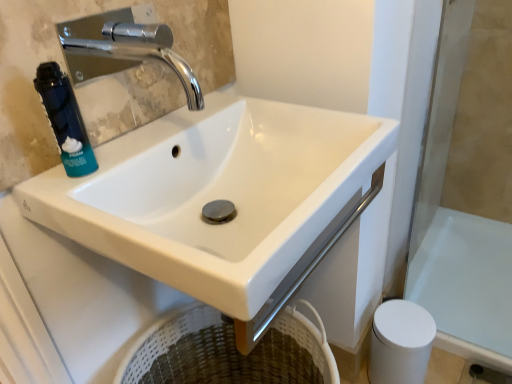
Question: Is the surface of white glossy bath at lower right in direct contact with white glossy sink at center?

Choices:
 (A) yes
 (B) no

Answer: (B)

Question: Can you confirm if white glossy bath at lower right is thinner than white glossy sink at center?

Choices:
 (A) yes
 (B) no

Answer: (B)

Question: Is white glossy bath at lower right facing towards white glossy sink at center?

Choices:
 (A) no
 (B) yes

Answer: (A)

Question: Is white glossy bath at lower right bigger than white glossy sink at center?

Choices:
 (A) yes
 (B) no

Answer: (B)

Question: Is white glossy bath at lower right to the right of white glossy sink at center from the viewer's perspective?

Choices:
 (A) no
 (B) yes

Answer: (B)

Question: Considering the positions of chrome metallic faucet at upper left and white glossy sink at center in the image, is chrome metallic faucet at upper left bigger or smaller than white glossy sink at center?

Choices:
 (A) small
 (B) big

Answer: (A)

Question: Does point (183, 59) appear closer or farther from the camera than point (274, 241)?

Choices:
 (A) closer
 (B) farther

Answer: (B)

Question: Do you think chrome metallic faucet at upper left is within white glossy sink at center, or outside of it?

Choices:
 (A) outside
 (B) inside

Answer: (A)

Question: In the image, is chrome metallic faucet at upper left positioned in front of or behind white glossy sink at center?

Choices:
 (A) front
 (B) behind

Answer: (B)

Question: Based on their positions, is chrome metallic faucet at upper left located to the left or right of blue matte foam canister at left?

Choices:
 (A) right
 (B) left

Answer: (A)

Question: From the image's perspective, is chrome metallic faucet at upper left positioned above or below blue matte foam canister at left?

Choices:
 (A) below
 (B) above

Answer: (B)

Question: From a real-world perspective, is chrome metallic faucet at upper left physically located above or below blue matte foam canister at left?

Choices:
 (A) above
 (B) below

Answer: (A)

Question: In terms of size, does chrome metallic faucet at upper left appear bigger or smaller than blue matte foam canister at left?

Choices:
 (A) big
 (B) small

Answer: (A)

Question: Does point (472, 284) appear closer or farther from the camera than point (109, 41)?

Choices:
 (A) closer
 (B) farther

Answer: (B)

Question: Would you say white glossy bath at lower right is inside or outside chrome metallic faucet at upper left?

Choices:
 (A) outside
 (B) inside

Answer: (A)